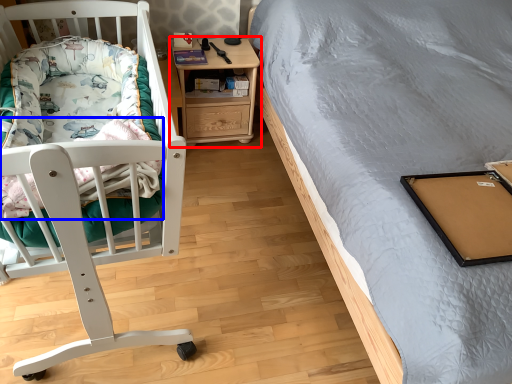
Question: Among these objects, which one is farthest to the camera, nightstand (highlighted by a red box) or blanket (highlighted by a blue box)?

Choices:
 (A) nightstand
 (B) blanket

Answer: (A)